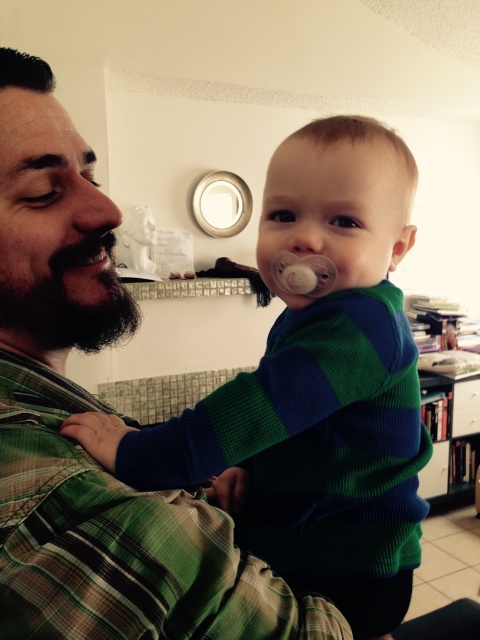
Consider the image. You are an observer looking at the scene. You notice the green striped sweater at upper center and the black matte beard at left. Which object appears bigger in the image?

The green striped sweater at upper center has a larger size compared to the black matte beard at left, so the green striped sweater at upper center appears bigger in the image.

You are an observer looking at the scene. The adult has a black matte beard at left and the baby is wearing a green striped sweater at upper center. Which object is positioned lower in the image?

The green striped sweater at upper center is located below the black matte beard at left, so the green striped sweater at upper center is positioned lower in the image.

You are an artist observing the scene and want to sketch the two beards. Which one is located to the right when looking at the black fuzzy beard at left and the black matte beard at left?

The black fuzzy beard at left is positioned to the right of the black matte beard at left.